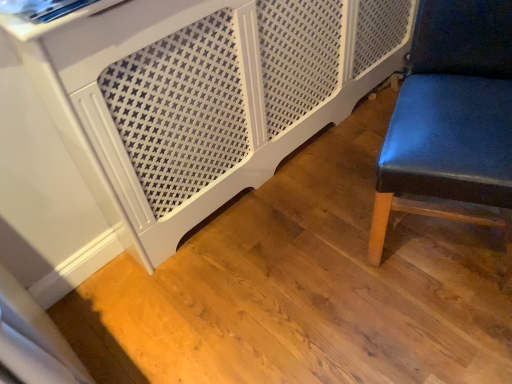
The image size is (512, 384). What do you see at coordinates (451, 112) in the screenshot?
I see `blue leather chair at right` at bounding box center [451, 112].

Consider the image. Measure the distance between point [492,181] and camera.

The distance of point [492,181] from camera is 3.33 feet.

Identify the location of blue leather chair at right. [451, 112].

Locate an element on the screen. The height and width of the screenshot is (384, 512). blue leather chair at right is located at coordinates (451, 112).